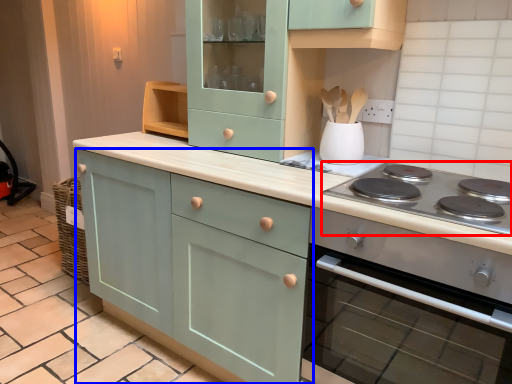
Question: Which of the following is the closest to the observer, gas stove (highlighted by a red box) or cabinetry (highlighted by a blue box)?

Choices:
 (A) gas stove
 (B) cabinetry

Answer: (A)